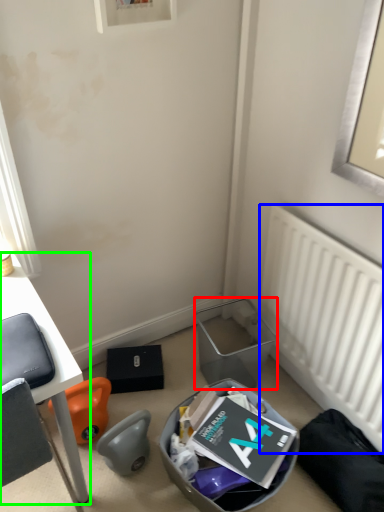
Question: Based on their relative distances, which object is nearer to trash bin/can (highlighted by a red box)? Choose from radiator (highlighted by a blue box) and desk (highlighted by a green box).

Choices:
 (A) radiator
 (B) desk

Answer: (A)